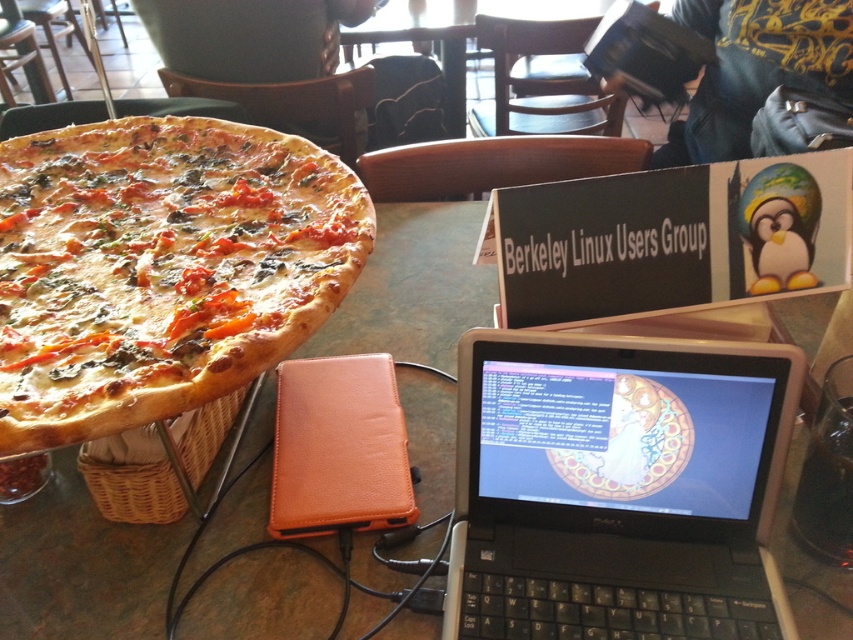
Question: Which of the following is the farthest from the observer?

Choices:
 (A) black plastic laptop at center
 (B) golden brown crusty pizza at left
 (C) brown leather table at center

Answer: (C)

Question: Can you confirm if black plastic laptop at center is bigger than brown leather table at center?

Choices:
 (A) yes
 (B) no

Answer: (B)

Question: Is black plastic laptop at center positioned before golden brown crusty pizza at left?

Choices:
 (A) no
 (B) yes

Answer: (A)

Question: Which point appears closest to the camera in this image?

Choices:
 (A) (57, 582)
 (B) (328, 310)
 (C) (473, 573)

Answer: (B)

Question: Where is black plastic laptop at center located in relation to brown leather table at center in the image?

Choices:
 (A) below
 (B) above

Answer: (A)

Question: Estimate the real-world distances between objects in this image. Which object is farther from the golden brown crusty pizza at left?

Choices:
 (A) black plastic laptop at center
 (B) brown leather table at center

Answer: (A)